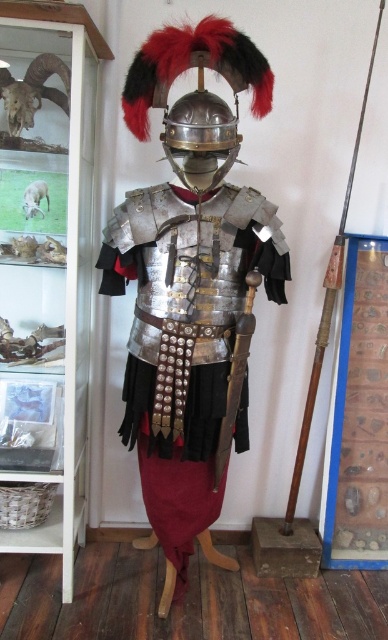
Does shiny silver helmet at center have a larger size compared to wooden shaft spear at right?

Incorrect, shiny silver helmet at center is not larger than wooden shaft spear at right.

Does shiny silver helmet at center appear on the right side of wooden shaft spear at right?

No, shiny silver helmet at center is not to the right of wooden shaft spear at right.

You are a GUI agent. You are given a task and a screenshot of the screen. Output one action in this format:
    pyautogui.click(x=<x>, y=<y>)
    Task: Click on the shiny silver helmet at center
    
    Given the screenshot: What is the action you would take?
    pyautogui.click(x=200, y=138)

The height and width of the screenshot is (640, 388). I want to click on shiny silver helmet at center, so click(x=200, y=138).

Which is more to the left, metallic armor at center or metallic sheen sword at center?

Positioned to the left is metallic armor at center.

What are the coordinates of `metallic armor at center` in the screenshot? It's located at (190, 346).

Between point (131, 369) and point (325, 310), which one is positioned in front?

Point (131, 369) is in front.

Can you confirm if metallic armor at center is positioned below wooden shaft spear at right?

Indeed, metallic armor at center is positioned under wooden shaft spear at right.

What do you see at coordinates (190, 346) in the screenshot? This screenshot has height=640, width=388. I see `metallic armor at center` at bounding box center [190, 346].

Image resolution: width=388 pixels, height=640 pixels. Identify the location of metallic armor at center. (190, 346).